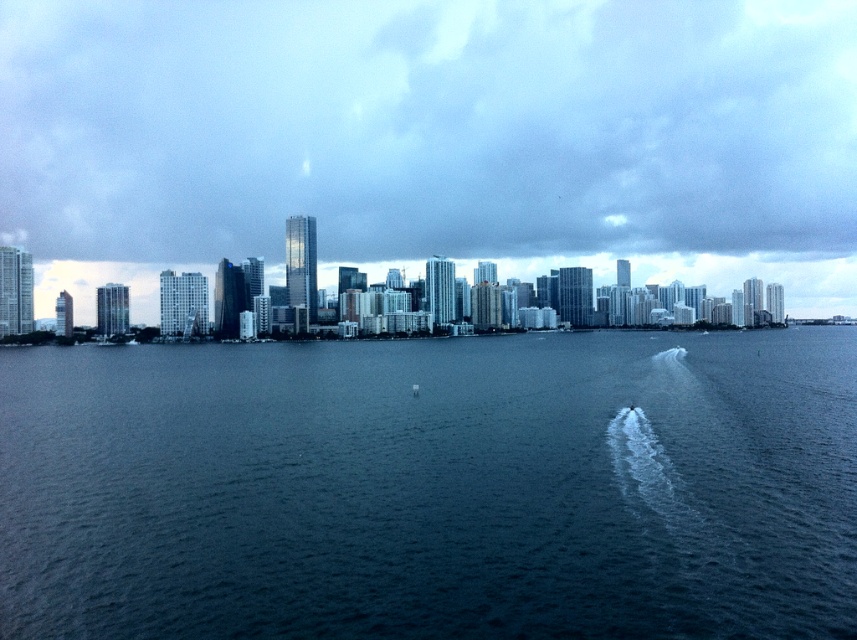
You are standing at the point marked by coordinates point (433,486) in the image. Looking around, you see dark blue water at center and a small boat in the middle distance. Which direction should you move to reach the small boat?

The small boat is located in the middle distance from the point (433,486), so you should move forward towards it to reach the small boat.

You are standing on a pier overlooking the dark blue water at center and the cloudy sky at upper center. Which object is nearer to you?

Result: The dark blue water at center is closer to the viewer than the cloudy sky at upper center.